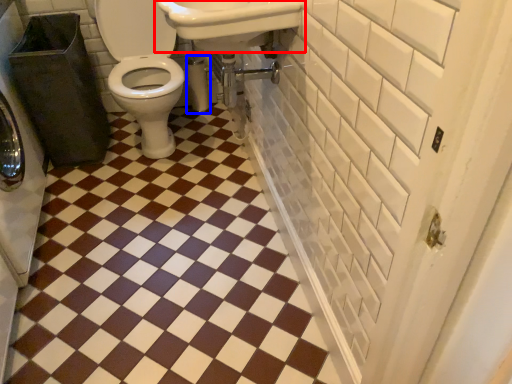
Question: Which of the following is the farthest to the observer, sink (highlighted by a red box) or toilet paper (highlighted by a blue box)?

Choices:
 (A) sink
 (B) toilet paper

Answer: (B)